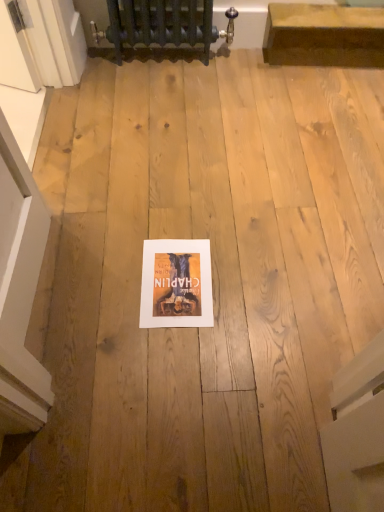
Where is `vacant space underneath matte paper poster at center (from a real-world perspective)`? vacant space underneath matte paper poster at center (from a real-world perspective) is located at coordinates (174, 275).